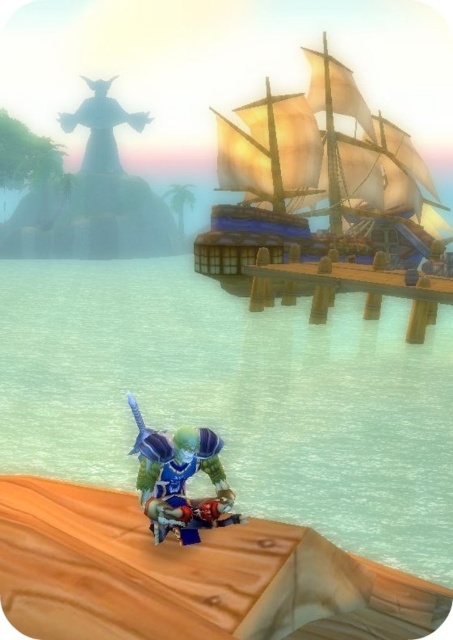
Question: Is wooden ship at upper right to the left of translucent stone statue at upper left from the viewer's perspective?

Choices:
 (A) yes
 (B) no

Answer: (B)

Question: Observing the image, what is the correct spatial positioning of wooden ship at upper right in reference to translucent stone statue at upper left?

Choices:
 (A) left
 (B) right

Answer: (B)

Question: Which object appears farthest from the camera in this image?

Choices:
 (A) translucent blue water at lower center
 (B) translucent stone statue at upper left
 (C) wooden ship at upper right
 (D) blue metallic armor at center

Answer: (B)

Question: Which of the following is the closest to the observer?

Choices:
 (A) wooden ship at upper right
 (B) translucent blue water at lower center

Answer: (B)

Question: Which object is closer to the camera taking this photo?

Choices:
 (A) blue metallic armor at center
 (B) translucent stone statue at upper left
 (C) translucent blue water at lower center
 (D) wooden ship at upper right

Answer: (A)

Question: Is blue metallic armor at center below translucent stone statue at upper left?

Choices:
 (A) no
 (B) yes

Answer: (B)